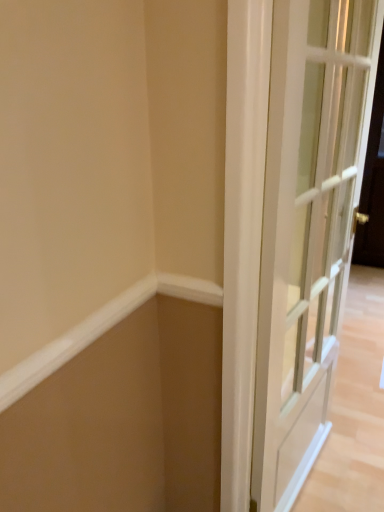
What do you see at coordinates (307, 227) in the screenshot?
I see `white glass door at right` at bounding box center [307, 227].

In order to click on white glass door at right in this screenshot , I will do `click(307, 227)`.

Where is `white glass door at right`? white glass door at right is located at coordinates (307, 227).